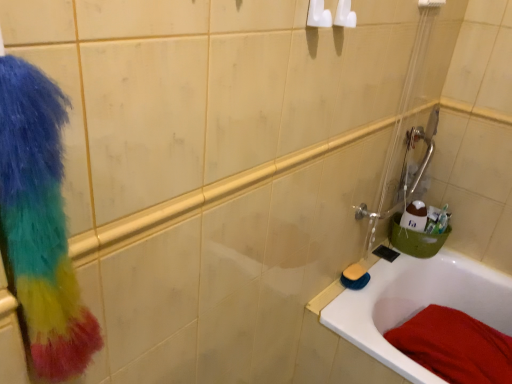
Identify the location of vacant space to the right of yellow sponge at lower right. This screenshot has width=512, height=384. (381, 269).